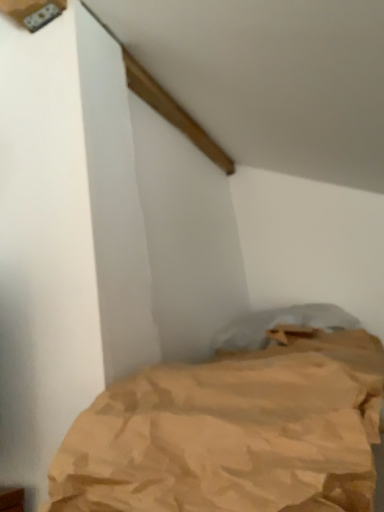
What is the approximate height of brown crumpled paper at lower right?

The height of brown crumpled paper at lower right is 8.43 inches.

This screenshot has width=384, height=512. What do you see at coordinates (232, 434) in the screenshot?
I see `brown crumpled paper at lower right` at bounding box center [232, 434].

Where is `brown crumpled paper at lower right`? brown crumpled paper at lower right is located at coordinates (232, 434).

The width and height of the screenshot is (384, 512). I want to click on brown crumpled paper at lower right, so click(232, 434).